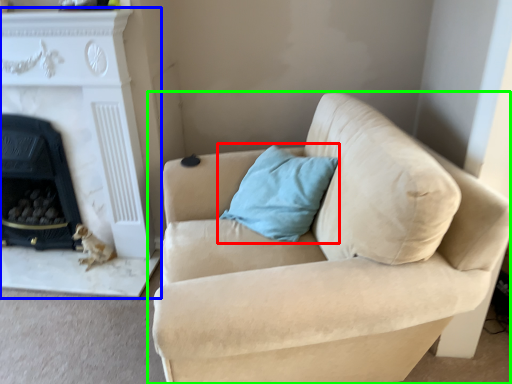
Question: Which object is positioned farthest from pillow (highlighted by a red box)? Select from fireplace (highlighted by a blue box) and studio couch (highlighted by a green box).

Choices:
 (A) fireplace
 (B) studio couch

Answer: (A)